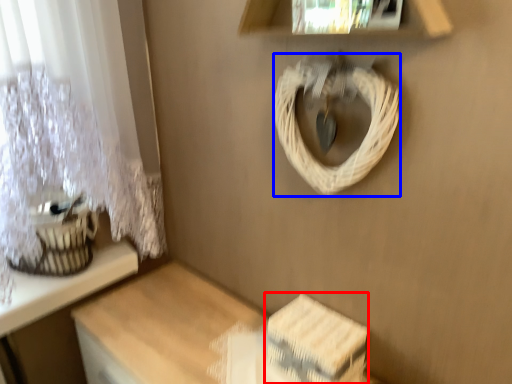
Question: Among these objects, which one is nearest to the camera, storage box (highlighted by a red box) or rope (highlighted by a blue box)?

Choices:
 (A) storage box
 (B) rope

Answer: (B)